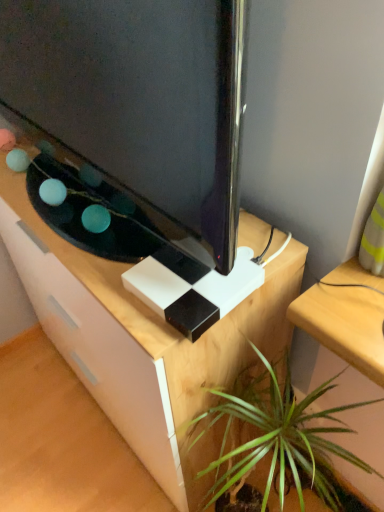
I want to click on green leafy plant at lower center, so click(278, 438).

Is white matte desk at center in contact with green leafy plant at lower center?

No, white matte desk at center is not making contact with green leafy plant at lower center.

Can you confirm if white matte desk at center is thinner than green leafy plant at lower center?

Incorrect, the width of white matte desk at center is not less than that of green leafy plant at lower center.

Which of these two, white matte desk at center or green leafy plant at lower center, stands taller?

Standing taller between the two is white matte desk at center.

How many degrees apart are the facing directions of white matte desk at center and green leafy plant at lower center?

0.685 degrees separate the facing orientations of white matte desk at center and green leafy plant at lower center.

From a real-world perspective, is matte black tv at center located beneath white matte desk at center?

Incorrect, from a real-world perspective, matte black tv at center is higher than white matte desk at center.

Is matte black tv at center behind white matte desk at center?

No, it is not.

Based on the photo, from their relative heights in the image, would you say matte black tv at center is taller or shorter than white matte desk at center?

Clearly, matte black tv at center is shorter compared to white matte desk at center.

Is green leafy plant at lower center inside or outside of white matte desk at center?

The correct answer is: outside.

Can you tell me how much green leafy plant at lower center and white matte desk at center differ in facing direction?

0.685 degrees separate the facing orientations of green leafy plant at lower center and white matte desk at center.

Is green leafy plant at lower center positioned behind white matte desk at center?

No, the depth of green leafy plant at lower center is less than that of white matte desk at center.

Where is `houseplant in front of the white matte desk at center`? houseplant in front of the white matte desk at center is located at coordinates (278, 438).

Does white matte desk at center appear on the left side of matte black tv at center?

No.

From the picture: From the image's perspective, is white matte desk at center located beneath matte black tv at center?

Yes.

Considering the relative positions of white matte desk at center and matte black tv at center in the image provided, is white matte desk at center in front of matte black tv at center?

No, it is behind matte black tv at center.

Is white matte desk at center aimed at matte black tv at center?

No, white matte desk at center is not aimed at matte black tv at center.

Looking at this image, how different are the orientations of green leafy plant at lower center and matte black tv at center in degrees?

They differ by 0.455 degrees in their facing directions.

Identify the location of television located on the left of green leafy plant at lower center. The height and width of the screenshot is (512, 384). (139, 97).

Who is more distant, green leafy plant at lower center or matte black tv at center?

green leafy plant at lower center is further from the camera.

Would you say green leafy plant at lower center contains matte black tv at center?

No.

Who is shorter, matte black tv at center or green leafy plant at lower center?

matte black tv at center.

Locate an element on the screen. This screenshot has height=512, width=384. houseplant below the matte black tv at center (from a real-world perspective) is located at coordinates (278, 438).

Between matte black tv at center and green leafy plant at lower center, which one has smaller size?

Smaller between the two is green leafy plant at lower center.

At what (x,y) coordinates should I click in order to perform the action: click on desk above the green leafy plant at lower center (from the image's perspective). Please return your answer as a coordinate pair (x, y). This screenshot has width=384, height=512. Looking at the image, I should click on (142, 340).

I want to click on television that appears above the white matte desk at center (from a real-world perspective), so click(139, 97).

Which object lies further to the anchor point white matte desk at center, green leafy plant at lower center or matte black tv at center?

Among the two, matte black tv at center is located further to white matte desk at center.

Considering their positions, is green leafy plant at lower center positioned closer to matte black tv at center than white matte desk at center?

The object closer to matte black tv at center is white matte desk at center.

Which object lies nearer to the anchor point white matte desk at center, matte black tv at center or green leafy plant at lower center?

Based on the image, green leafy plant at lower center appears to be nearer to white matte desk at center.

Looking at the image, which one is located further to green leafy plant at lower center, white matte desk at center or matte black tv at center?

Among the two, matte black tv at center is located further to green leafy plant at lower center.

Which object lies nearer to the anchor point green leafy plant at lower center, matte black tv at center or white matte desk at center?

white matte desk at center is positioned closer to the anchor green leafy plant at lower center.

Considering their positions, is white matte desk at center positioned further to matte black tv at center than green leafy plant at lower center?

The object further to matte black tv at center is green leafy plant at lower center.

The height and width of the screenshot is (512, 384). Identify the location of desk between matte black tv at center and green leafy plant at lower center in the up-down direction. (142, 340).